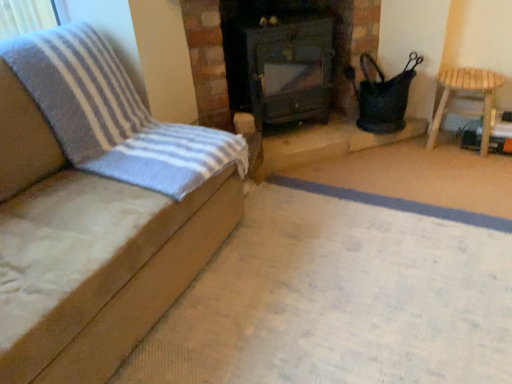
Question: From a real-world perspective, relative to light brown wooden stool at right, arranged as the 2th furniture when viewed from the front, is suede-like beige sofa at left, which appears as the first furniture when viewed from the left, vertically above or below?

Choices:
 (A) below
 (B) above

Answer: (B)

Question: Is suede-like beige sofa at left, the 2th furniture when ordered from back to front, taller or shorter than light brown wooden stool at right, which ranks as the first furniture in right-to-left order?

Choices:
 (A) short
 (B) tall

Answer: (B)

Question: Estimate the real-world distances between objects in this image. Which object is farther from the light brown wooden stool at right, which is the second furniture in left-to-right order?

Choices:
 (A) dark green wood stove at center
 (B) suede-like beige sofa at left, which ranks as the 1th furniture in front-to-back order

Answer: (B)

Question: Which object is the closest to the dark green wood stove at center?

Choices:
 (A) suede-like beige sofa at left, which ranks as the 1th furniture in front-to-back order
 (B) light brown wooden stool at right, which is the second furniture in left-to-right order

Answer: (B)